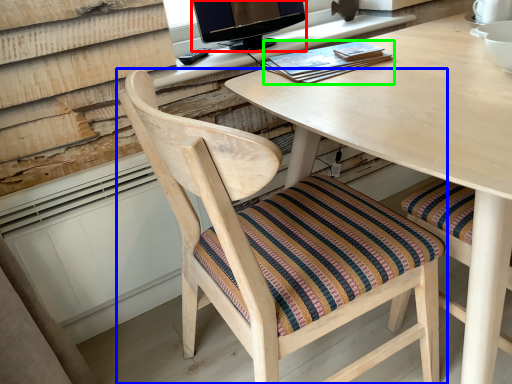
Question: Estimate the real-world distances between objects in this image. Which object is closer to television (highlighted by a red box), chair (highlighted by a blue box) or book (highlighted by a green box)?

Choices:
 (A) chair
 (B) book

Answer: (B)